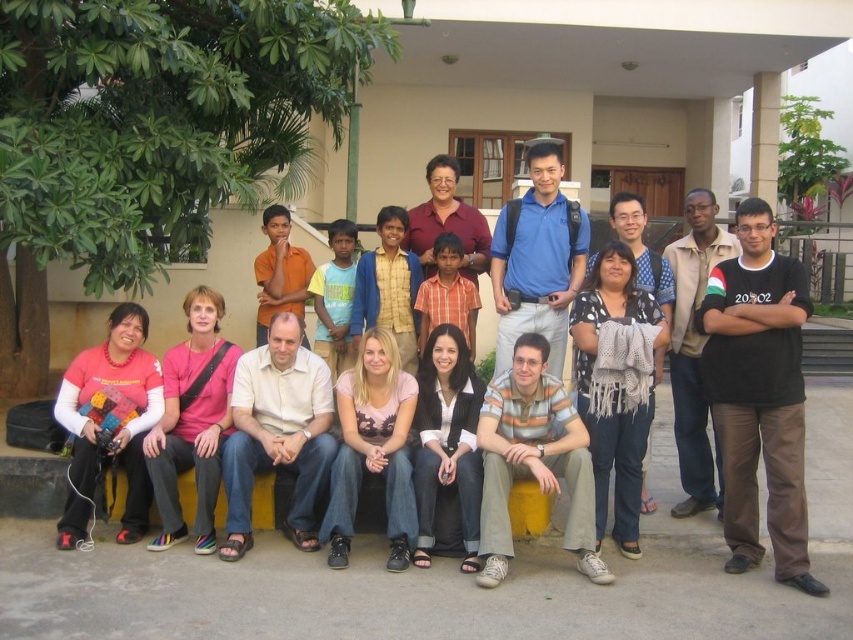
Does pink fabric shirt at lower left appear on the left side of pink fabric shirt at center?

Yes, pink fabric shirt at lower left is to the left of pink fabric shirt at center.

Does point (125, 536) come behind point (187, 435)?

No.

Find the location of a particular element. Image resolution: width=853 pixels, height=640 pixels. pink fabric shirt at lower left is located at coordinates (113, 426).

Can you confirm if pink cotton shirt at center is smaller than knitted gray scarf at center?

Actually, pink cotton shirt at center might be larger than knitted gray scarf at center.

Does pink cotton shirt at center lie in front of knitted gray scarf at center?

Yes, it is.

Which is in front, point (354, 508) or point (579, 352)?

Point (354, 508)

Locate an element on the screen. The width and height of the screenshot is (853, 640). pink cotton shirt at center is located at coordinates (372, 449).

Which is in front, point (212, 372) or point (345, 445)?

Point (345, 445) is in front.

Can you confirm if pink fabric shirt at center is positioned above pink cotton shirt at center?

Yes.

Between point (189, 332) and point (355, 499), which one is positioned behind?

The point (189, 332) is behind.

Locate an element on the screen. The image size is (853, 640). pink fabric shirt at center is located at coordinates (192, 420).